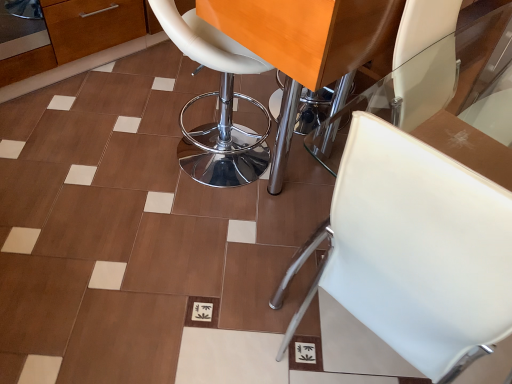
Question: From a real-world perspective, is white leather stool at center, the second chair positioned from the right, physically located above or below white leather chair at center, positioned as the 2th chair in left-to-right order?

Choices:
 (A) below
 (B) above

Answer: (B)

Question: Is point (216, 137) closer or farther from the camera than point (354, 145)?

Choices:
 (A) farther
 (B) closer

Answer: (A)

Question: Considering their positions, is white leather stool at center, the 1th chair positioned from the left, located in front of or behind white leather chair at center, the 1th chair positioned from the right?

Choices:
 (A) front
 (B) behind

Answer: (B)

Question: From a real-world perspective, relative to white leather stool at center, the second chair positioned from the right, is white leather chair at center, positioned as the 2th chair in left-to-right order, vertically above or below?

Choices:
 (A) above
 (B) below

Answer: (B)

Question: Is white leather chair at center, the 1th chair positioned from the right, wider or thinner than white leather stool at center, the second chair positioned from the right?

Choices:
 (A) thin
 (B) wide

Answer: (B)

Question: Considering the positions of white leather chair at center, the 1th chair positioned from the right, and white leather stool at center, the 1th chair positioned from the left, in the image, is white leather chair at center, the 1th chair positioned from the right, taller or shorter than white leather stool at center, the 1th chair positioned from the left,?

Choices:
 (A) tall
 (B) short

Answer: (B)

Question: From the image's perspective, relative to white leather stool at center, the second chair positioned from the right, is white leather chair at center, the 1th chair positioned from the right, above or below?

Choices:
 (A) below
 (B) above

Answer: (A)